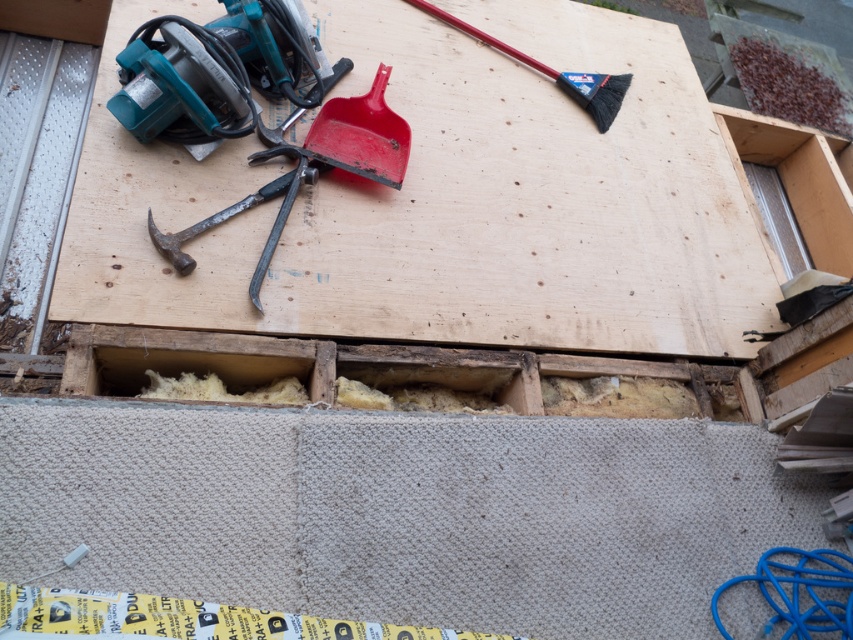
From the picture: You are a worker who needs to reach both the black plastic brush at upper right and the rusty metal hammer at center. Which object is taller and requires more vertical space to store?

The black plastic brush at upper right is much taller than the rusty metal hammer at center, so it requires more vertical space to store.

In the construction scene, there are two hammers present. The metallic hammer at left and the rusty metal hammer at center. Which hammer is positioned to the right of the other?

The metallic hammer at left is positioned to the right of the rusty metal hammer at center.